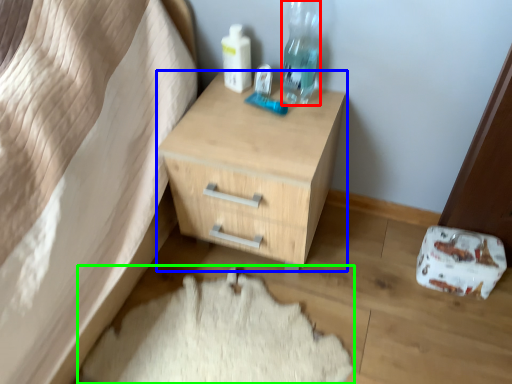
Question: Which object is the closest to the bottle (highlighted by a red box)? Choose among these: chest of drawers (highlighted by a blue box) or sheet (highlighted by a green box).

Choices:
 (A) chest of drawers
 (B) sheet

Answer: (A)